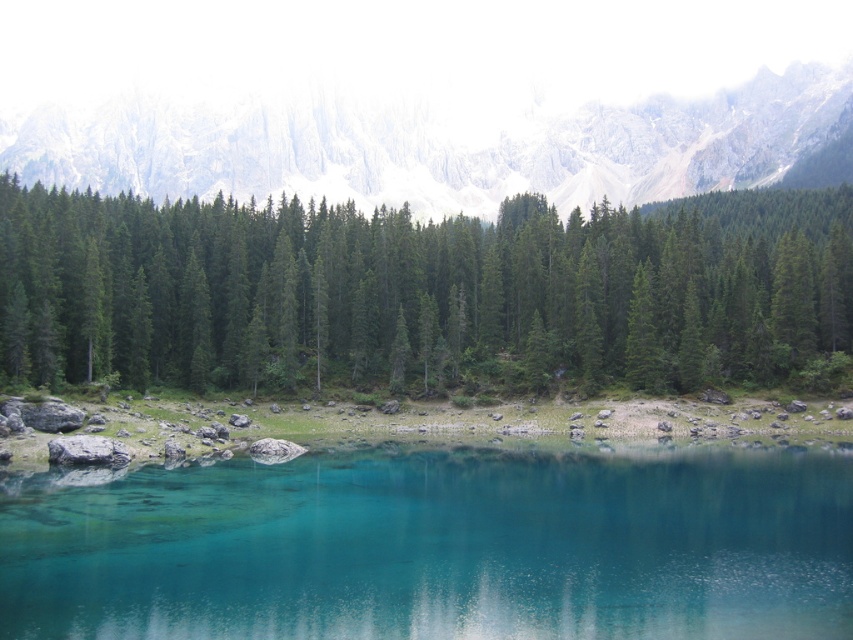
You are standing at the lakeside and want to take a photo of both the green matte pine forest at center and the transparent glass water at center. Which object will appear larger in the photo due to its height?

The green matte pine forest at center will appear larger in the photo because it is much taller than the transparent glass water at center.

You are standing at the edge of the lake and want to see the reflection of the green matte pine forest at center in the transparent glass water at center. Can you see the forest reflected clearly in the water?

The transparent glass water at center is behind green matte pine forest at center, so the reflection of the green matte pine forest at center would be visible in the transparent glass water at center since the water is calm and reflective as described in the scene.